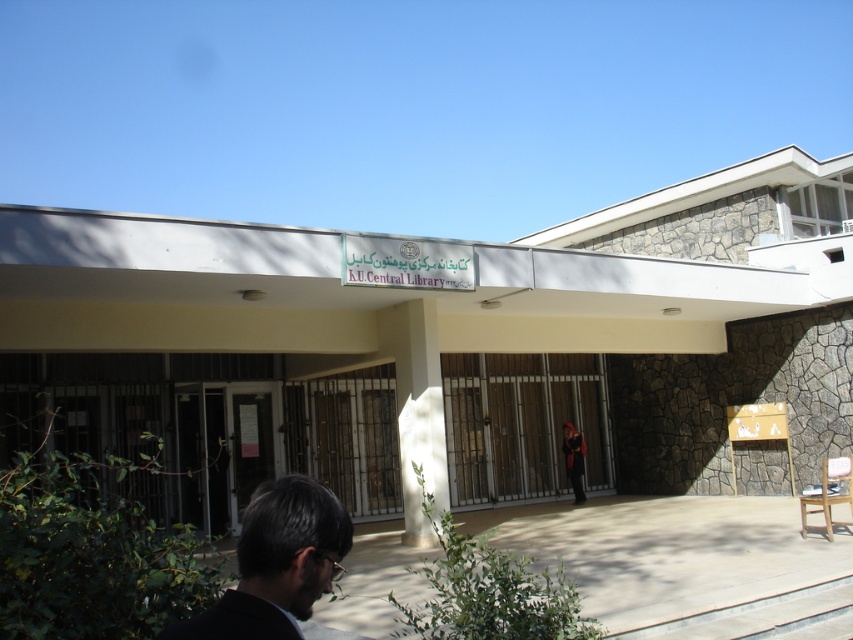
Is metallic gate at center to the left of dark red fabric at center from the viewer's perspective?

Yes, metallic gate at center is to the left of dark red fabric at center.

Looking at this image, does metallic gate at center have a smaller size compared to dark red fabric at center?

Incorrect, metallic gate at center is not smaller in size than dark red fabric at center.

Identify the location of metallic gate at center. (521, 422).

Locate an element on the screen. The width and height of the screenshot is (853, 640). metallic gate at center is located at coordinates (521, 422).

Which is behind, point (273, 570) or point (576, 440)?

The point (576, 440) is behind.

What do you see at coordinates (277, 563) in the screenshot? I see `dark brown hair at lower left` at bounding box center [277, 563].

Who is more distant from viewer, (338, 550) or (581, 481)?

Point (581, 481)

This screenshot has width=853, height=640. Find the location of `dark brown hair at lower left`. dark brown hair at lower left is located at coordinates (277, 563).

Looking at this image, which is more to the left, metallic gate at center or dark brown hair at lower left?

dark brown hair at lower left

Between metallic gate at center and dark brown hair at lower left, which one has more height?

With more height is metallic gate at center.

What do you see at coordinates (521, 422) in the screenshot?
I see `metallic gate at center` at bounding box center [521, 422].

Where is `metallic gate at center`? The width and height of the screenshot is (853, 640). metallic gate at center is located at coordinates (521, 422).